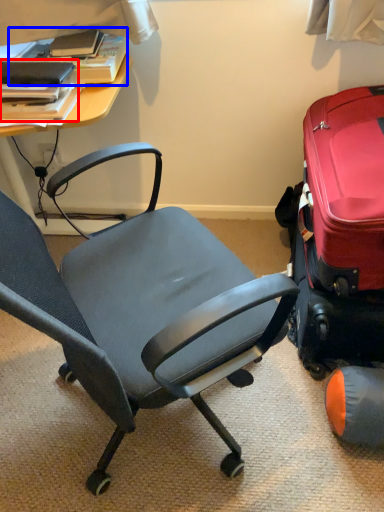
Question: Which point is further to the camera, book (highlighted by a red box) or book (highlighted by a blue box)?

Choices:
 (A) book
 (B) book

Answer: (B)